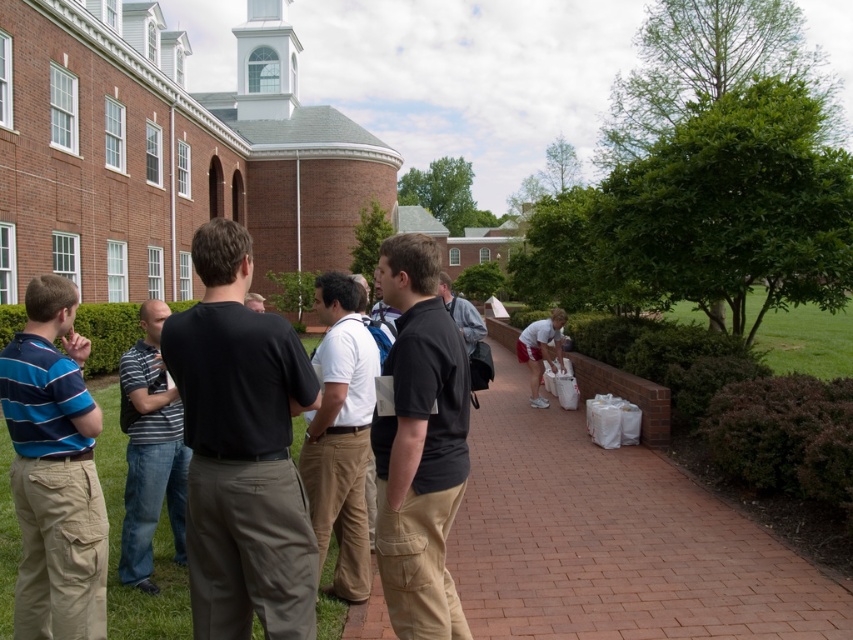
You are a photographer setting up a camera on the brick pathway. You want to capture both the black cotton shirt at center and the gray fabric jacket at center in a single shot. Which object should you focus on first to ensure both are in frame?

You should focus on the black cotton shirt at center first since it is wider than the gray fabric jacket at center, ensuring that the wider object is centered to include both in the frame.

You are standing on the brick pathway in the scene and want to walk towards the building with the white steeple. Which point, point (654, 579) or point (540, 360), is closer to you as you face the building?

Point (654, 579) is closer to the viewer than point (540, 360), so it is the closer point when facing the building.